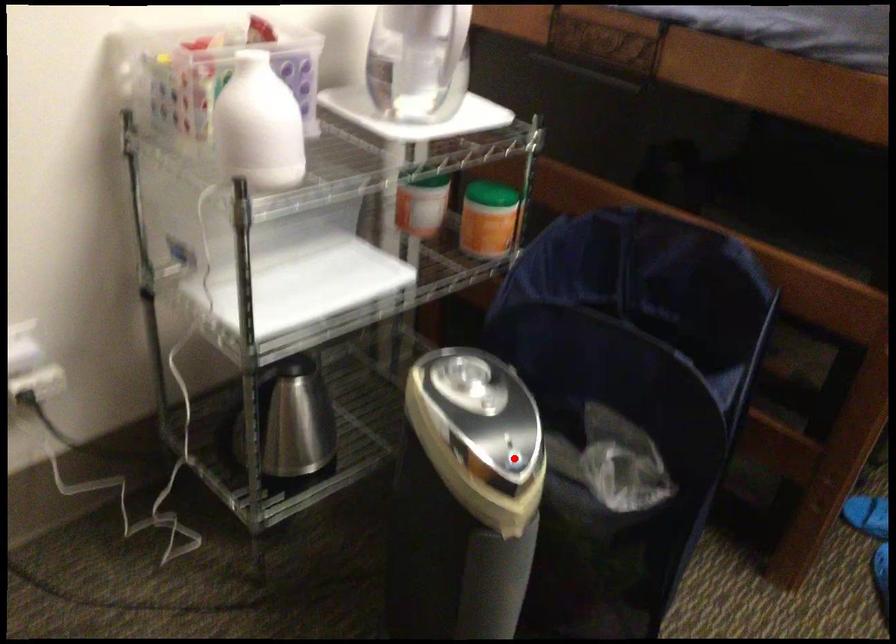
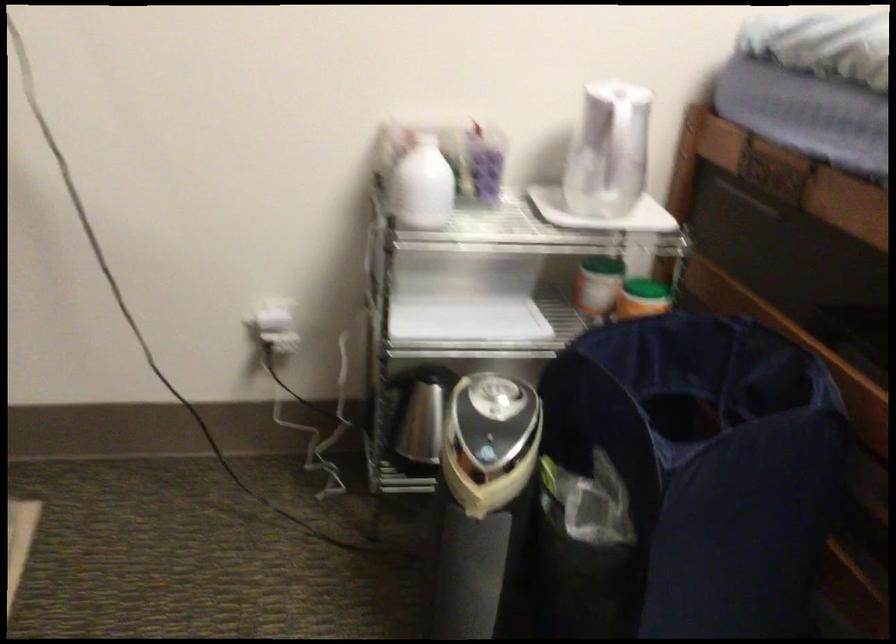
Locate, in the second image, the point that corresponds to the highlighted location in the first image.

(486, 453)